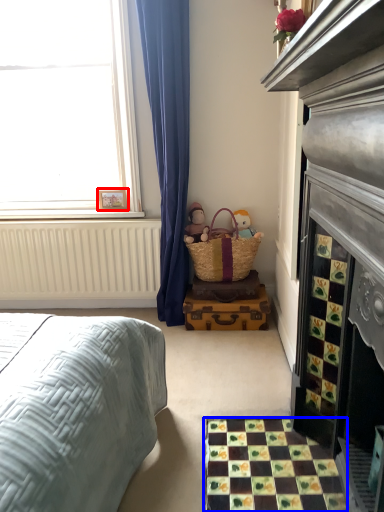
Question: Which of the following is the farthest to the observer, picture frame (highlighted by a red box) or tile (highlighted by a blue box)?

Choices:
 (A) picture frame
 (B) tile

Answer: (A)